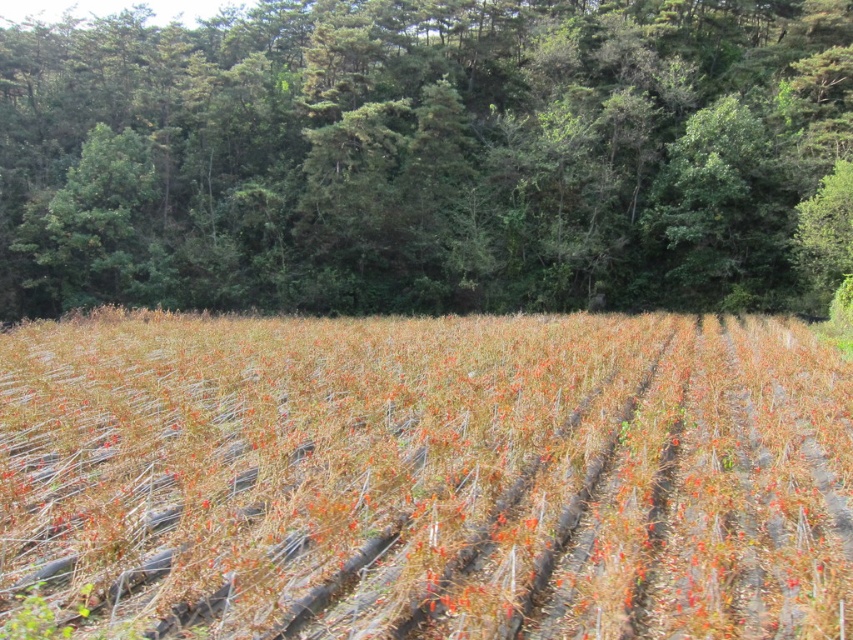
Is point (122, 424) behind point (758, 150)?

No, it is not.

Which is below, brown dry grass at center or green leafy tree at upper center?

brown dry grass at center

Is point (764, 324) less distant than point (292, 300)?

Yes, point (764, 324) is closer to viewer.

At what (x,y) coordinates should I click in order to perform the action: click on brown dry grass at center. Please return your answer as a coordinate pair (x, y). This screenshot has width=853, height=640. Looking at the image, I should click on (426, 476).